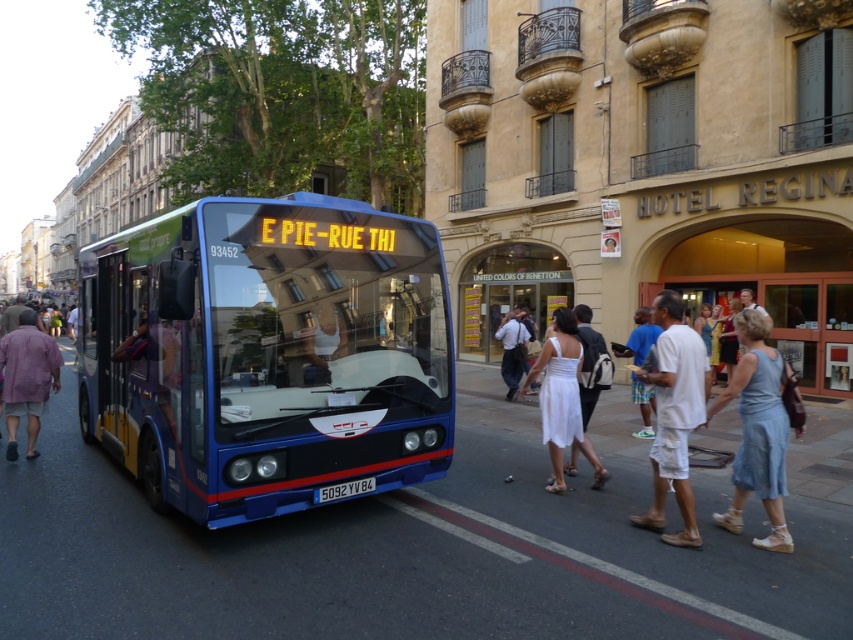
Is white cotton shorts at lower right to the left of white satin dress at center from the viewer's perspective?

In fact, white cotton shorts at lower right is to the right of white satin dress at center.

Between point (688, 397) and point (543, 432), which one is positioned behind?

Positioned behind is point (543, 432).

You are a GUI agent. You are given a task and a screenshot of the screen. Output one action in this format:
    pyautogui.click(x=<x>, y=<y>)
    Task: Click on the white cotton shorts at lower right
    
    Given the screenshot: What is the action you would take?
    pyautogui.click(x=674, y=416)

Does white cotton dress at center lie behind denim dress at lower right?

No, it is in front of denim dress at lower right.

Between point (763, 417) and point (792, 541), which one is positioned behind?

Point (792, 541)

Measure the distance between white cotton dress at center and camera.

A distance of 5.26 meters exists between white cotton dress at center and camera.

Where is `white cotton dress at center`? white cotton dress at center is located at coordinates (711, 417).

Is the position of white cotton shorts at lower right less distant than that of light purple cotton shirt at left?

That is True.

Is point (686, 532) farther from camera compared to point (55, 369)?

No, (686, 532) is in front of (55, 369).

At what (x,y) coordinates should I click in order to perform the action: click on white cotton shorts at lower right. Please return your answer as a coordinate pair (x, y). This screenshot has width=853, height=640. Looking at the image, I should click on (674, 416).